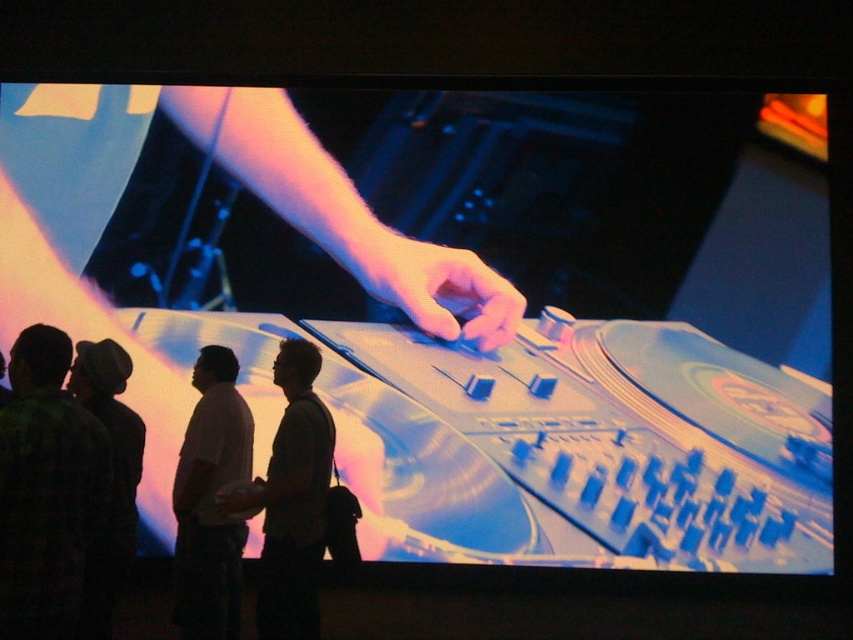
Question: Which object appears closest to the camera in this image?

Choices:
 (A) pink matte hand at center
 (B) matte black hand at center
 (C) white matte shirt at lower left
 (D) dark gray shirt at center

Answer: (D)

Question: Is green plaid shirt at lower left closer to the viewer compared to white matte shirt at lower left?

Choices:
 (A) no
 (B) yes

Answer: (B)

Question: Among these objects, which one is farthest from the camera?

Choices:
 (A) satin silver turntable at center
 (B) white matte shirt at lower left

Answer: (A)

Question: Observing the image, what is the correct spatial positioning of dark gray shirt at center in reference to matte black hand at center?

Choices:
 (A) above
 (B) below

Answer: (A)

Question: Among these points, which one is nearest to the camera?

Choices:
 (A) (753, 554)
 (B) (242, 486)
 (C) (404, 246)
 (D) (44, 637)

Answer: (D)

Question: Is satin silver turntable at center further to camera compared to matte black hand at center?

Choices:
 (A) yes
 (B) no

Answer: (A)